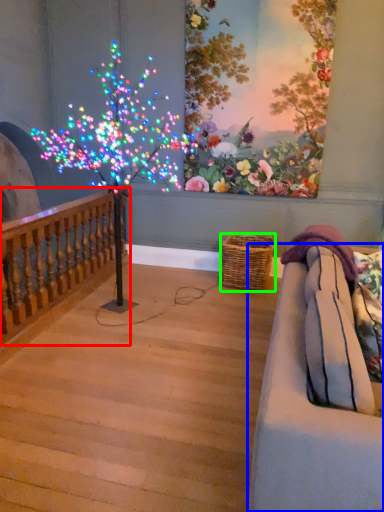
Question: Based on their relative distances, which object is farther from rail (highlighted by a red box)? Choose from studio couch (highlighted by a blue box) and basket (highlighted by a green box).

Choices:
 (A) studio couch
 (B) basket

Answer: (A)